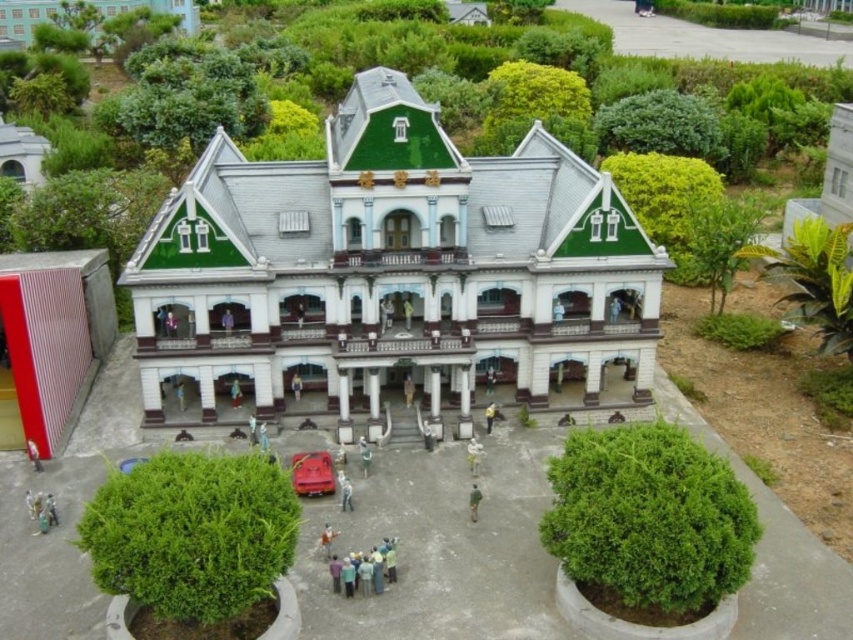
Question: Can you confirm if green matte figure at center is positioned to the left of light brown wooden door at center?

Choices:
 (A) yes
 (B) no

Answer: (B)

Question: Which object is closer to the camera taking this photo?

Choices:
 (A) white matte statue at center
 (B) green matte figure at center

Answer: (B)

Question: Among these objects, which one is nearest to the camera?

Choices:
 (A) yellow fabric person at center
 (B) white matte statue at center
 (C) light blue fabric group at lower center

Answer: (C)

Question: Considering the relative positions of light blue fabric group at lower center and white matte statue at center in the image provided, where is light blue fabric group at lower center located with respect to white matte statue at center?

Choices:
 (A) above
 (B) below

Answer: (B)

Question: Is smooth beige coat at center wider than light brown wooden door at center?

Choices:
 (A) no
 (B) yes

Answer: (A)

Question: Which point is closer to the camera taking this photo?

Choices:
 (A) (476, 486)
 (B) (222, 324)

Answer: (A)